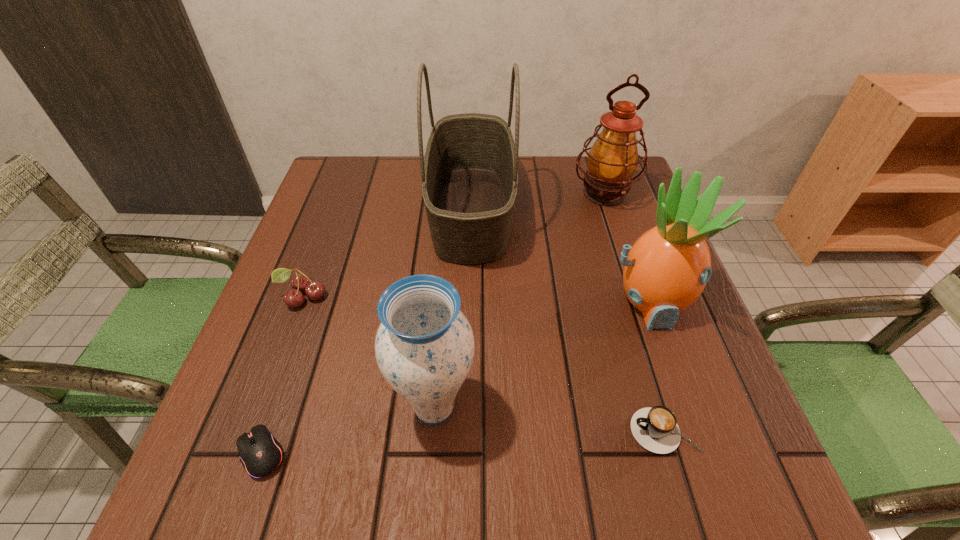
At what (x,y) coordinates should I click in order to perform the action: click on free spot at the left edge of the desktop. Please return your answer as a coordinate pair (x, y). Looking at the image, I should click on (x=297, y=246).

Locate an element on the screen. Image resolution: width=960 pixels, height=540 pixels. free space at the right edge of the desktop is located at coordinates (671, 340).

At what (x,y) coordinates should I click in order to perform the action: click on free space that is in between the cherry and the computer mouse. Please return your answer as a coordinate pair (x, y). This screenshot has height=540, width=960. Looking at the image, I should click on (282, 375).

Where is `free area in between the basket and the pineapple`? free area in between the basket and the pineapple is located at coordinates (561, 256).

Where is `vacant point located between the third shortest object and the vase`? The height and width of the screenshot is (540, 960). vacant point located between the third shortest object and the vase is located at coordinates (369, 353).

The height and width of the screenshot is (540, 960). Identify the location of free space between the basket and the pineapple. (561, 256).

The height and width of the screenshot is (540, 960). What are the coordinates of `free spot between the cappuccino and the oil lamp` in the screenshot? It's located at (635, 313).

You are a GUI agent. You are given a task and a screenshot of the screen. Output one action in this format:
    pyautogui.click(x=<x>, y=<y>)
    Task: Click on the free point between the pineapple and the basket
    
    Given the screenshot: What is the action you would take?
    pyautogui.click(x=561, y=256)

Identify the location of the second closest object relative to the computer mouse. The image size is (960, 540). (300, 283).

Find the location of a particular element. This screenshot has width=960, height=540. object that is the third closest one to the oil lamp is located at coordinates (424, 347).